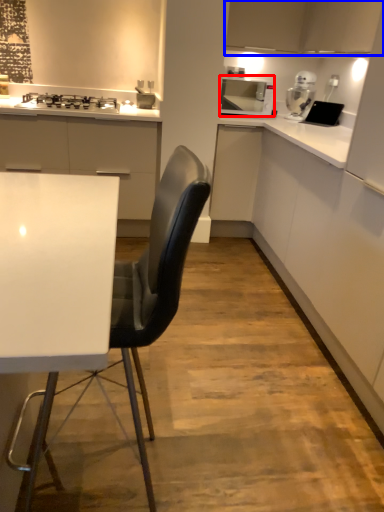
Question: Which of the following is the closest to the observer, home appliance (highlighted by a red box) or cabinetry (highlighted by a blue box)?

Choices:
 (A) home appliance
 (B) cabinetry

Answer: (B)